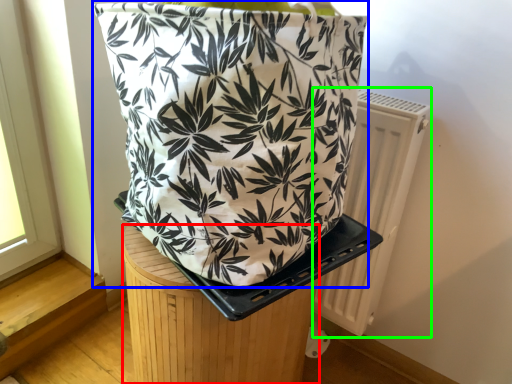
Question: Considering the real-world distances, which object is closest to furniture (highlighted by a red box)? handbag (highlighted by a blue box) or radiator (highlighted by a green box).

Choices:
 (A) handbag
 (B) radiator

Answer: (A)